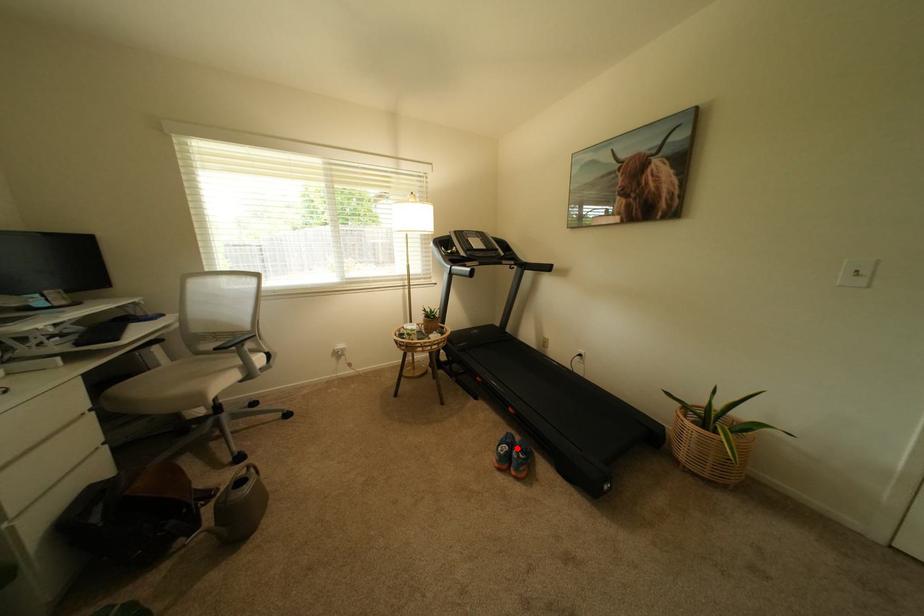
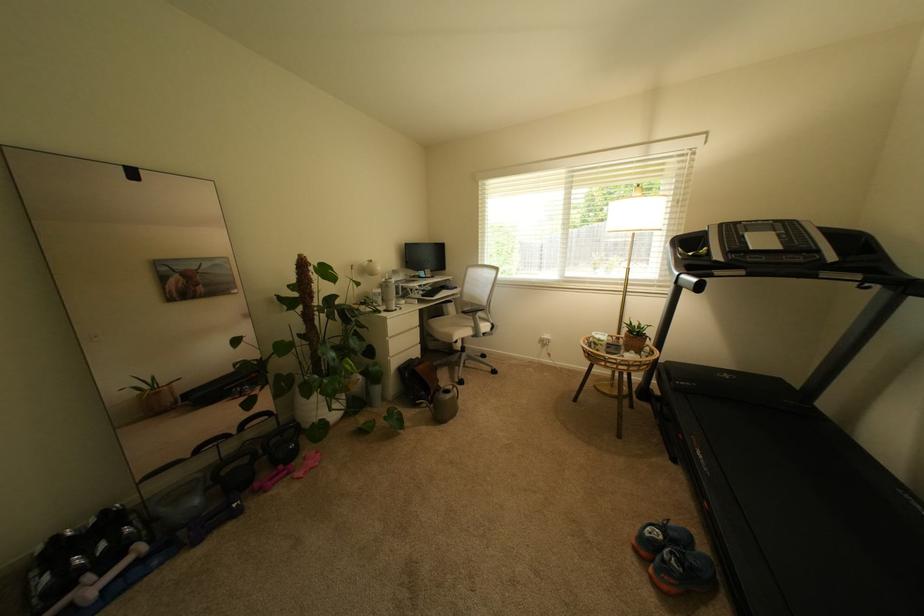
Question: I am providing you with two images of the same scene from different viewpoints. Image1 has a red point marked. In image2, the corresponding 3D location appears at what relative position? Reply with the corresponding letter.

Choices:
 (A) Closer
 (B) Farther

Answer: (B)